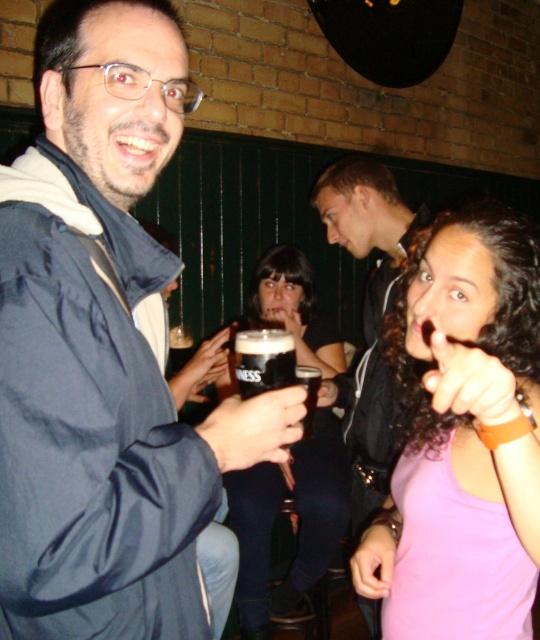
You are a photographer at the bar and want to ensure both the pink matte tank top at center and the black glass beer at center are clearly visible in your photo. Which object should you focus on first to ensure it appears sharp, considering their sizes?

The pink matte tank top at center is larger in size than the black glass beer at center, so focusing on the pink matte tank top at center first will ensure it appears sharp, and the smaller black glass beer at center should also be in focus due to its proximity in depth of field.

You are standing in the bar and want to hand a drink to the person wearing the blue nylon jacket at center. According to the scene, where should you look to find them?

The blue nylon jacket at center is located at point 0.547 on the horizontal axis and 0.193 on the vertical axis, so you should look towards the middle right and lower part of the scene to find the person wearing the blue nylon jacket at center.

You are a bartender who needs to place a new drink order. You have a limited space between the pink matte tank top at center and the black glass beer at center. What is the minimum distance required between these two items to fit the drink?

The minimum distance required between the pink matte tank top at center and the black glass beer at center is 8.95 inches, so the drink must be placed within this space.